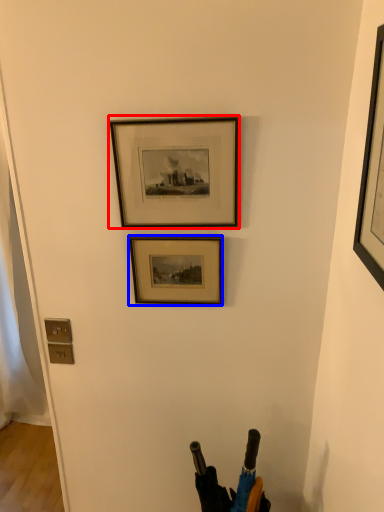
Question: Which object appears farthest to the camera in this image, picture frame (highlighted by a red box) or picture frame (highlighted by a blue box)?

Choices:
 (A) picture frame
 (B) picture frame

Answer: (B)